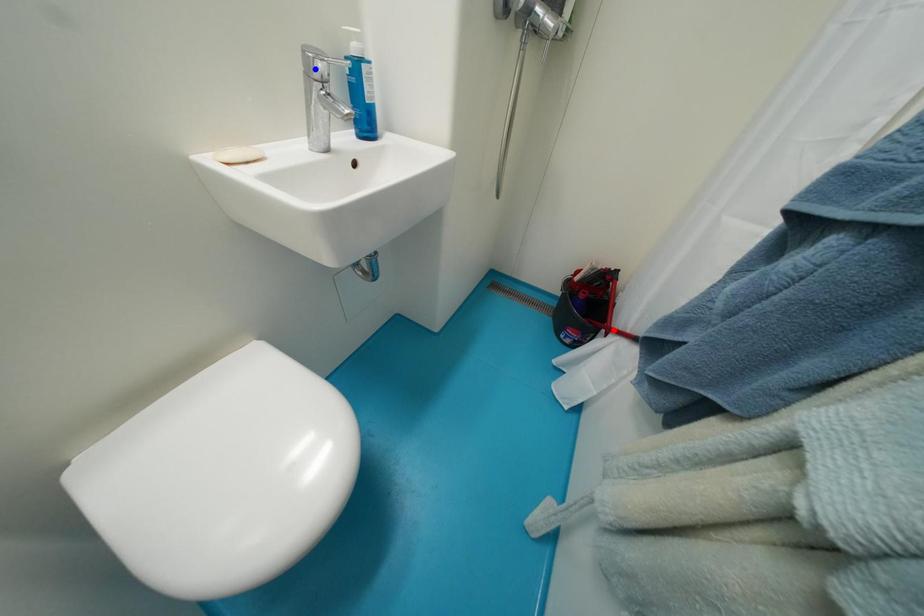
Question: Two points are marked on the image. Which point is closer to the camera?

Choices:
 (A) Blue point is closer.
 (B) Red point is closer.

Answer: (A)